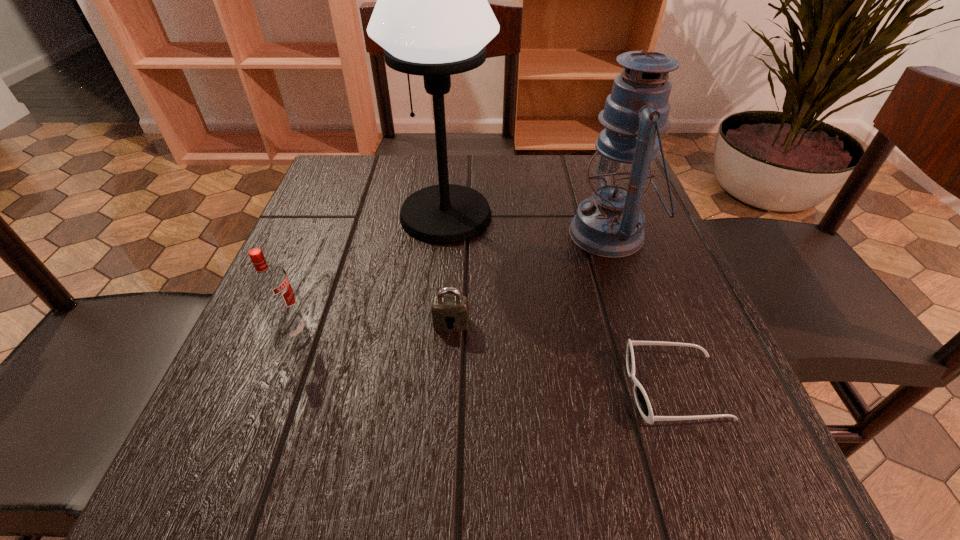
Locate an element on the screen. Image resolution: width=960 pixels, height=540 pixels. sunglasses that is at the right edge is located at coordinates (641, 398).

Where is `object situated at the far right corner`? The width and height of the screenshot is (960, 540). object situated at the far right corner is located at coordinates (609, 224).

Where is `free space at the far edge of the desktop`? free space at the far edge of the desktop is located at coordinates (407, 176).

This screenshot has height=540, width=960. Identify the location of free location at the near edge. (547, 454).

In the image, there is a desktop. Identify the location of vacant space at the left edge. (250, 408).

Identify the location of vacant space at the right edge of the desktop. (652, 224).

Find the location of a particular element. This screenshot has height=540, width=960. vacant region at the far left corner of the desktop is located at coordinates (386, 181).

Locate an element on the screen. vacant space at the near left corner of the desktop is located at coordinates (300, 467).

Find the location of a particular element. The width and height of the screenshot is (960, 540). vacant area that lies between the table lamp and the padlock is located at coordinates (448, 269).

This screenshot has height=540, width=960. Find the location of `unoccupied position between the second tallest object and the vodka`. unoccupied position between the second tallest object and the vodka is located at coordinates (450, 283).